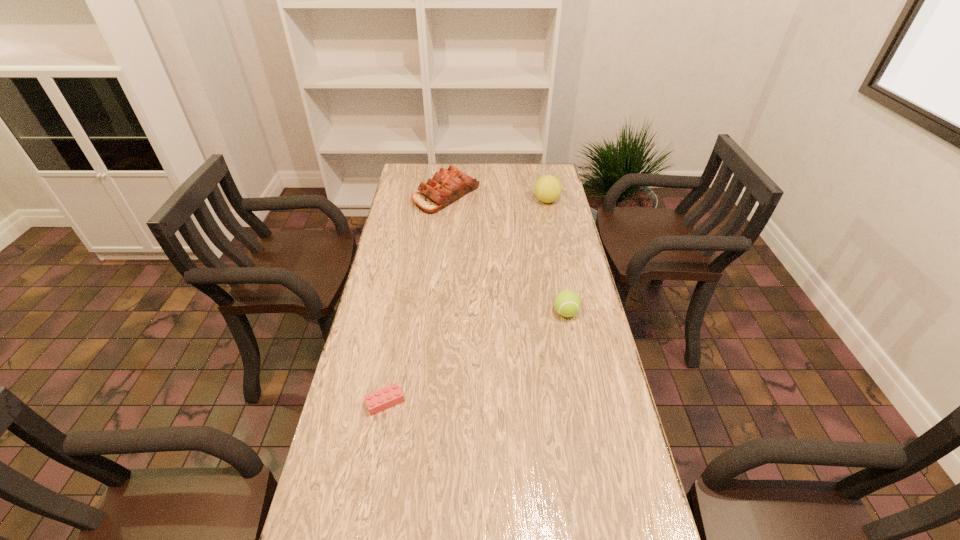
You are a GUI agent. You are given a task and a screenshot of the screen. Output one action in this format:
    pyautogui.click(x=<x>, y=<y>)
    Task: Click on the object at the far edge
    The height and width of the screenshot is (540, 960).
    Given the screenshot: What is the action you would take?
    pyautogui.click(x=447, y=186)

I want to click on bread present at the left edge, so click(447, 186).

Locate an element on the screen. Image resolution: width=960 pixels, height=540 pixels. Lego that is at the left edge is located at coordinates (387, 397).

Locate an element on the screen. The height and width of the screenshot is (540, 960). object at the far left corner is located at coordinates (447, 186).

In the image, there is a desktop. Identify the location of vacant space at the far edge. (449, 165).

Identify the location of free region at the left edge of the desktop. (357, 487).

In the image, there is a desktop. Identify the location of vacant space at the right edge. (566, 233).

Find the location of a particular element. This screenshot has width=960, height=540. blank space at the far left corner of the desktop is located at coordinates (405, 175).

Identify the location of free space between the farther tennis ball and the bread. The width and height of the screenshot is (960, 540). pyautogui.click(x=496, y=198).

You are a GUI agent. You are given a task and a screenshot of the screen. Output one action in this format:
    pyautogui.click(x=<x>, y=<y>)
    Task: Click on the unoccupied area between the farther tennis ball and the bread
    This screenshot has height=540, width=960.
    Given the screenshot: What is the action you would take?
    pyautogui.click(x=496, y=198)